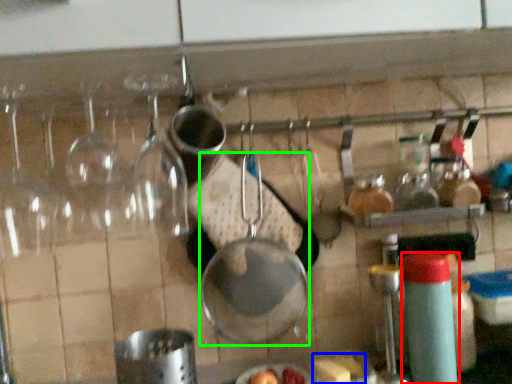
Question: Which is nearer to the bottle (highlighted by a red box)? food (highlighted by a blue box) or frying pan (highlighted by a green box).

Choices:
 (A) food
 (B) frying pan

Answer: (A)